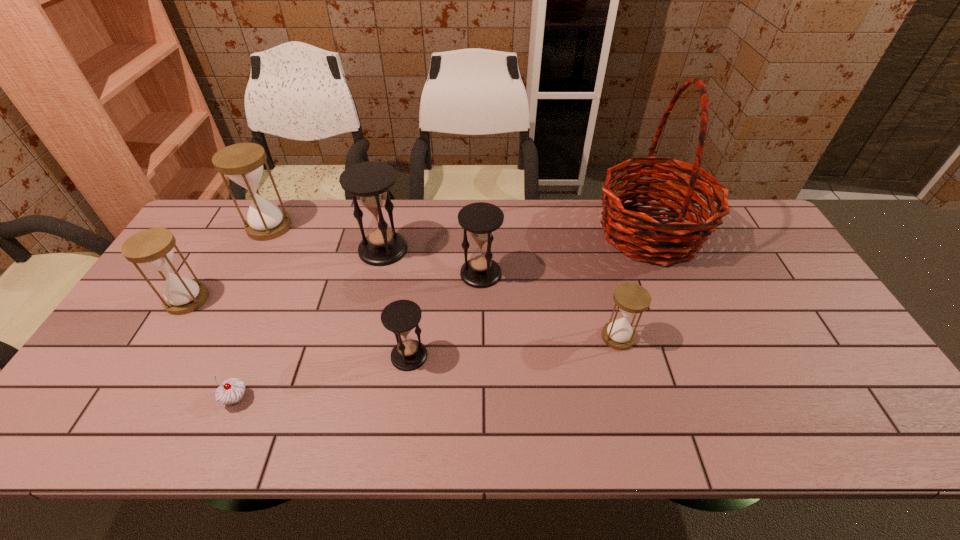
Find the location of a particular element. free space between the second black hourglass from right to left and the third object from left to right is located at coordinates (323, 377).

Locate an element on the screen. vacant space that is in between the leftmost black hourglass and the second smallest white hourglass is located at coordinates (285, 274).

This screenshot has height=540, width=960. I want to click on free space between the rightmost hourglass and the gray cupcake, so click(x=427, y=368).

The image size is (960, 540). I want to click on vacant area between the rightmost black hourglass and the tallest object, so click(565, 253).

Find the location of a particular element. The height and width of the screenshot is (540, 960). free point between the farthest white hourglass and the third hourglass from left to right is located at coordinates (326, 238).

At what (x,y) coordinates should I click in order to perform the action: click on free spot between the second hourglass from right to left and the second black hourglass from right to left. Please return your answer as a coordinate pair (x, y). The height and width of the screenshot is (540, 960). Looking at the image, I should click on (444, 314).

Identify the location of vacant space in between the fourth object from right to left and the rightmost black hourglass. (444, 314).

Locate an element on the screen. vacant area that lies between the cupcake and the nearest black hourglass is located at coordinates (323, 377).

The height and width of the screenshot is (540, 960). Identify the location of free space between the second hourglass from right to left and the nearest object. (358, 336).

Identify the location of object that ranks as the fourth closest to the leftmost black hourglass. The height and width of the screenshot is (540, 960). (153, 248).